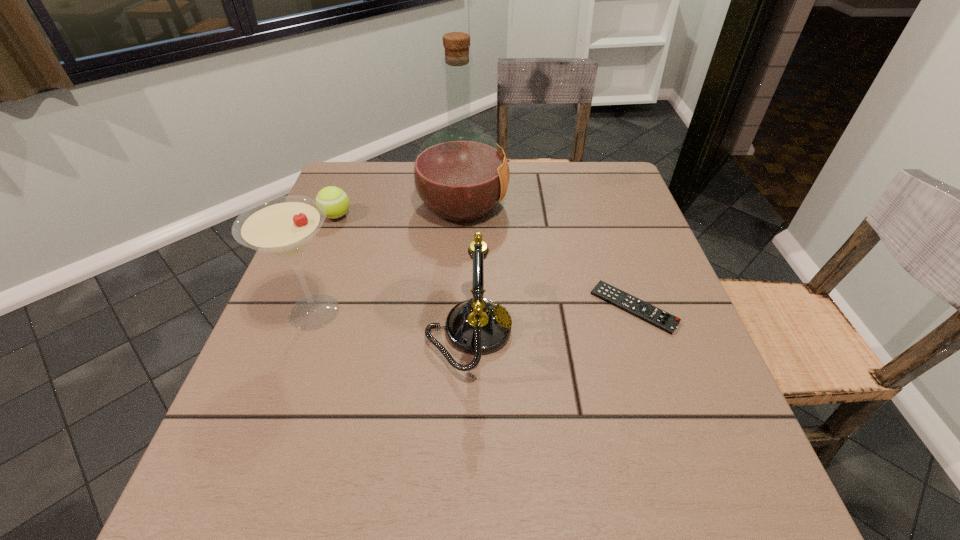
Identify the location of free space located on the back of the rightmost object. (593, 187).

Identify the location of liquor that is at the far edge. This screenshot has height=540, width=960. (460, 174).

Locate an element on the screen. tennis ball that is at the far edge is located at coordinates (336, 202).

The width and height of the screenshot is (960, 540). What are the coordinates of `martini that is at the left edge` in the screenshot? It's located at (283, 227).

Find the location of `tennis ball that is at the left edge`. tennis ball that is at the left edge is located at coordinates (336, 202).

I want to click on object that is at the right edge, so click(663, 320).

I want to click on object that is at the far left corner, so click(x=336, y=202).

The height and width of the screenshot is (540, 960). I want to click on vacant space at the far edge, so click(529, 205).

Identify the location of vacant space at the near edge of the desktop. (518, 531).

Image resolution: width=960 pixels, height=540 pixels. In the image, there is a desktop. Find the location of `vacant space at the left edge`. vacant space at the left edge is located at coordinates (342, 262).